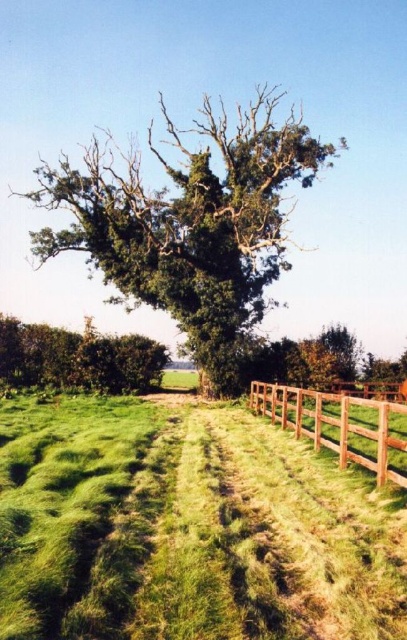
Between point (256, 196) and point (295, 394), which one is positioned behind?

The point (256, 196) is behind.

Is point (269, 198) positioned in front of point (361, 452)?

No, (269, 198) is behind (361, 452).

At what (x,y) coordinates should I click in order to perform the action: click on green leafy tree at center. Please return your answer as a coordinate pair (x, y). Looking at the image, I should click on (188, 224).

Locate an element on the screen. The height and width of the screenshot is (640, 407). green leafy tree at center is located at coordinates (188, 224).

Does green leafy tree at center have a larger size compared to green leafy bush at lower left?

Indeed, green leafy tree at center has a larger size compared to green leafy bush at lower left.

Is point (245, 200) positioned after point (24, 385)?

Yes, point (245, 200) is behind point (24, 385).

This screenshot has height=640, width=407. In order to click on green leafy tree at center in this screenshot , I will do `click(188, 224)`.

At what (x,y) coordinates should I click in order to perform the action: click on green leafy bush at lower left. Please return your answer as a coordinate pair (x, y). The image size is (407, 640). Looking at the image, I should click on coord(78,356).

This screenshot has height=640, width=407. In order to click on green leafy bush at lower left in this screenshot , I will do `click(78, 356)`.